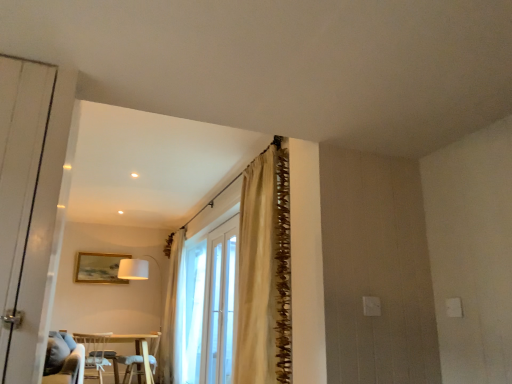
Question: Is velvet blue armchair at lower center bigger or smaller than white fabric chair at lower left?

Choices:
 (A) small
 (B) big

Answer: (B)

Question: Is velvet blue armchair at lower center to the left or to the right of white fabric chair at lower left in the image?

Choices:
 (A) left
 (B) right

Answer: (B)

Question: Which is farther from the beige textured curtain at upper center, acting as the first curtain starting from the right?

Choices:
 (A) white fabric chair at lower left
 (B) white wooden door at left
 (C) velvet blue armchair at lower center
 (D) clear glass door at center
 (E) white sheer curtain at center, acting as the first curtain starting from the back

Answer: (C)

Question: Estimate the real-world distances between objects in this image. Which object is farther from the velvet blue armchair at lower center?

Choices:
 (A) white glass bay window at center
 (B) gold metallic picture frame at upper center
 (C) beige textured curtain at upper center, acting as the first curtain starting from the right
 (D) white sheer curtain at center, the 2th curtain from the front
 (E) white fabric chair at lower left

Answer: (C)